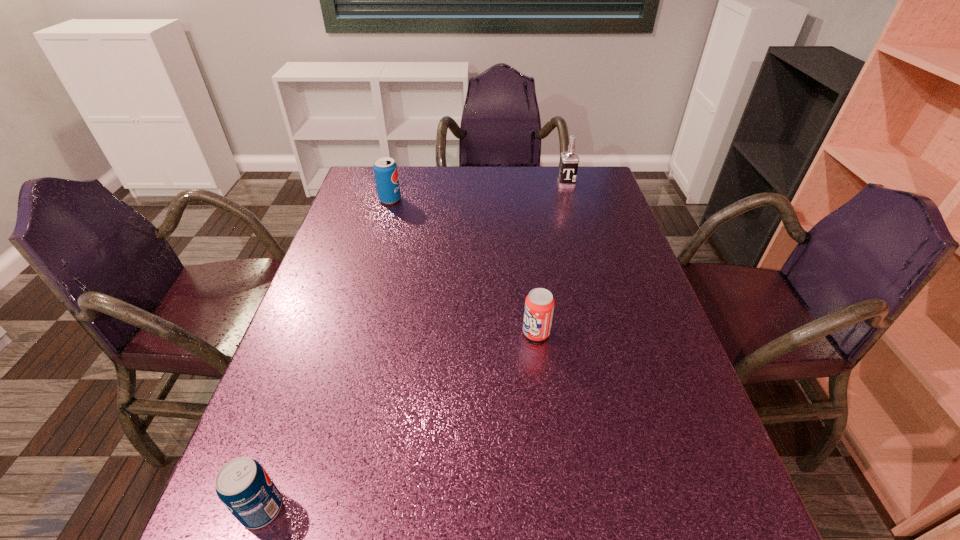
Where is `vacant space that's between the second farthest soda can and the second farthest object`? vacant space that's between the second farthest soda can and the second farthest object is located at coordinates coord(463,266).

This screenshot has height=540, width=960. I want to click on free space between the nearest soda can and the tallest object, so click(414, 346).

Locate an element on the screen. This screenshot has height=540, width=960. vacant space that's between the second nearest object and the farthest soda can is located at coordinates (463, 266).

The image size is (960, 540). In order to click on free space between the farthest soda can and the farthest object in this screenshot , I will do `click(478, 192)`.

In order to click on vacant space that's between the third nearest object and the rightmost soda can in this screenshot , I will do `click(463, 266)`.

Locate an element on the screen. This screenshot has width=960, height=540. free point between the tallest object and the third nearest object is located at coordinates (478, 192).

This screenshot has width=960, height=540. In order to click on vacant region between the farthest soda can and the rightmost object in this screenshot , I will do `click(478, 192)`.

This screenshot has height=540, width=960. I want to click on free spot between the nearest soda can and the second farthest object, so click(x=326, y=354).

Where is `blank region between the nearest object and the vodka`? The image size is (960, 540). blank region between the nearest object and the vodka is located at coordinates (414, 346).

Where is `free space between the third object from left to right and the third nearest object`? Image resolution: width=960 pixels, height=540 pixels. free space between the third object from left to right and the third nearest object is located at coordinates (463, 266).